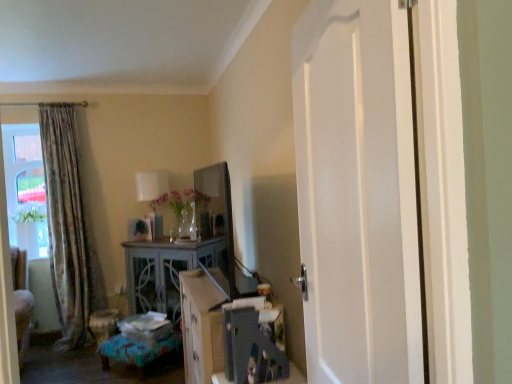
Describe the element at coordinates (68, 227) in the screenshot. I see `floral fabric curtain at left` at that location.

At what (x,y) coordinates should I click in order to perform the action: click on clear glass vase at center. Please return your answer as a coordinate pair (x, y). The width and height of the screenshot is (512, 384). Looking at the image, I should click on (184, 224).

What is the approximate height of distressed wood cabinet at center?

91.43 centimeters.

Where is `white fabric lampshade at upper center`? The image size is (512, 384). white fabric lampshade at upper center is located at coordinates (151, 185).

Where is `textured blue fabric ottoman at lower center`? textured blue fabric ottoman at lower center is located at coordinates (136, 351).

Is point (153, 178) positioned in front of point (381, 33)?

That is False.

Can we say white fabric lampshade at upper center lies outside white smooth door at center?

Indeed, white fabric lampshade at upper center is completely outside white smooth door at center.

Who is bigger, white fabric lampshade at upper center or white smooth door at center?

white smooth door at center.

From a real-world perspective, which object stands above the other?

In real-world perspective, white smooth door at center is above.

Is clear glass vase at center bigger than white smooth door at center?

No, clear glass vase at center is not bigger than white smooth door at center.

Does clear glass vase at center touch white smooth door at center?

No, clear glass vase at center is not with white smooth door at center.

From the image's perspective, is clear glass vase at center above or below white smooth door at center?

clear glass vase at center is below white smooth door at center.

From a real-world perspective, is floral fabric curtain at left above or below white smooth door at center?

Clearly, from a real-world perspective, floral fabric curtain at left is below white smooth door at center.

Between floral fabric curtain at left and white smooth door at center, which one has less height?

With less height is white smooth door at center.

You are a GUI agent. You are given a task and a screenshot of the screen. Output one action in this format:
    pyautogui.click(x=<x>, y=<y>)
    Task: Click on the curtain behind the white smooth door at center
    Image resolution: width=512 pixels, height=384 pixels.
    Given the screenshot: What is the action you would take?
    pyautogui.click(x=68, y=227)

Is the surface of clear glass vase at center in direct contact with floral fabric curtain at left?

clear glass vase at center and floral fabric curtain at left are not in contact.

Where is `vase that appears above the floral fabric curtain at left (from the image's perspective)`? This screenshot has height=384, width=512. vase that appears above the floral fabric curtain at left (from the image's perspective) is located at coordinates (184, 224).

Is clear glass vase at center wider than floral fabric curtain at left?

No, clear glass vase at center is not wider than floral fabric curtain at left.

From the image's perspective, does textured blue fabric ottoman at lower center appear higher than clear glass vase at center?

No.

Between textured blue fabric ottoman at lower center and clear glass vase at center, which one is positioned behind?

clear glass vase at center.

What are the coordinates of `vase on the right of textured blue fabric ottoman at lower center` in the screenshot? It's located at (184, 224).

Would you say textured blue fabric ottoman at lower center is to the left or to the right of clear glass vase at center in the picture?

Based on their positions, textured blue fabric ottoman at lower center is located to the left of clear glass vase at center.

In the scene shown: What's the angular difference between clear glass vase at center and white fabric lampshade at upper center's facing directions?

clear glass vase at center and white fabric lampshade at upper center are facing 0.00117 degrees away from each other.

Locate an element on the screen. lamp above the clear glass vase at center (from the image's perspective) is located at coordinates (151, 185).

Do you think clear glass vase at center is within white fabric lampshade at upper center, or outside of it?

clear glass vase at center is spatially situated outside white fabric lampshade at upper center.

Does clear glass vase at center appear on the right side of white fabric lampshade at upper center?

Indeed, clear glass vase at center is positioned on the right side of white fabric lampshade at upper center.

Which is more to the left, white smooth door at center or distressed wood cabinet at center?

From the viewer's perspective, distressed wood cabinet at center appears more on the left side.

Identify the location of door that appears in front of the distressed wood cabinet at center. (358, 192).

Is white smooth door at center placed right next to distressed wood cabinet at center?

No.

In terms of height, does white smooth door at center look taller or shorter compared to distressed wood cabinet at center?

Considering their sizes, white smooth door at center has more height than distressed wood cabinet at center.

You are a GUI agent. You are given a task and a screenshot of the screen. Output one action in this format:
    pyautogui.click(x=<x>, y=<y>)
    Task: Click on the lamp that is under the white smooth door at center (from a real-world perspective)
    The height and width of the screenshot is (384, 512).
    Given the screenshot: What is the action you would take?
    pyautogui.click(x=151, y=185)

At what (x,y) coordinates should I click in order to perform the action: click on door located on the right of clear glass vase at center. Please return your answer as a coordinate pair (x, y). The width and height of the screenshot is (512, 384). Looking at the image, I should click on (358, 192).

Looking at the image, which one is located closer to white fabric lampshade at upper center, textured blue fabric ottoman at lower center or clear glass vase at center?

clear glass vase at center lies closer to white fabric lampshade at upper center than the other object.

Consider the image. When comparing their distances from white smooth door at center, does distressed wood cabinet at center or white fabric lampshade at upper center seem closer?

distressed wood cabinet at center is closer to white smooth door at center.

Considering their positions, is distressed wood cabinet at center positioned closer to clear glass vase at center than white smooth door at center?

Among the two, distressed wood cabinet at center is located nearer to clear glass vase at center.

Based on their spatial positions, is textured blue fabric ottoman at lower center or white fabric lampshade at upper center closer to distressed wood cabinet at center?

textured blue fabric ottoman at lower center is positioned closer to the anchor distressed wood cabinet at center.

Considering their positions, is clear glass vase at center positioned closer to white fabric lampshade at upper center than distressed wood cabinet at center?

The object closer to white fabric lampshade at upper center is clear glass vase at center.

Estimate the real-world distances between objects in this image. Which object is closer to clear glass vase at center, white fabric lampshade at upper center or floral fabric curtain at left?

white fabric lampshade at upper center lies closer to clear glass vase at center than the other object.

Estimate the real-world distances between objects in this image. Which object is closer to floral fabric curtain at left, white fabric lampshade at upper center or textured blue fabric ottoman at lower center?

white fabric lampshade at upper center.

Which object lies nearer to the anchor point white fabric lampshade at upper center, clear glass vase at center or white smooth door at center?

Among the two, clear glass vase at center is located nearer to white fabric lampshade at upper center.

Where is `vase between white fabric lampshade at upper center and textured blue fabric ottoman at lower center from top to bottom`? vase between white fabric lampshade at upper center and textured blue fabric ottoman at lower center from top to bottom is located at coordinates (184, 224).

Locate an element on the screen. The image size is (512, 384). table between clear glass vase at center and textured blue fabric ottoman at lower center from top to bottom is located at coordinates (167, 271).

Identify the location of lamp situated between floral fabric curtain at left and clear glass vase at center from left to right. (151, 185).

Where is `curtain between white fabric lampshade at upper center and textured blue fabric ottoman at lower center vertically`? The image size is (512, 384). curtain between white fabric lampshade at upper center and textured blue fabric ottoman at lower center vertically is located at coordinates (68, 227).